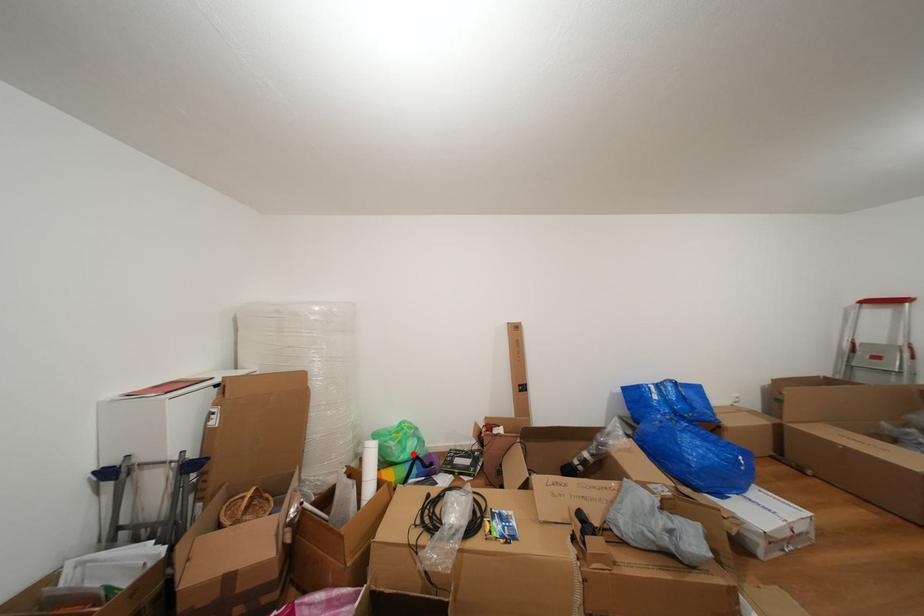
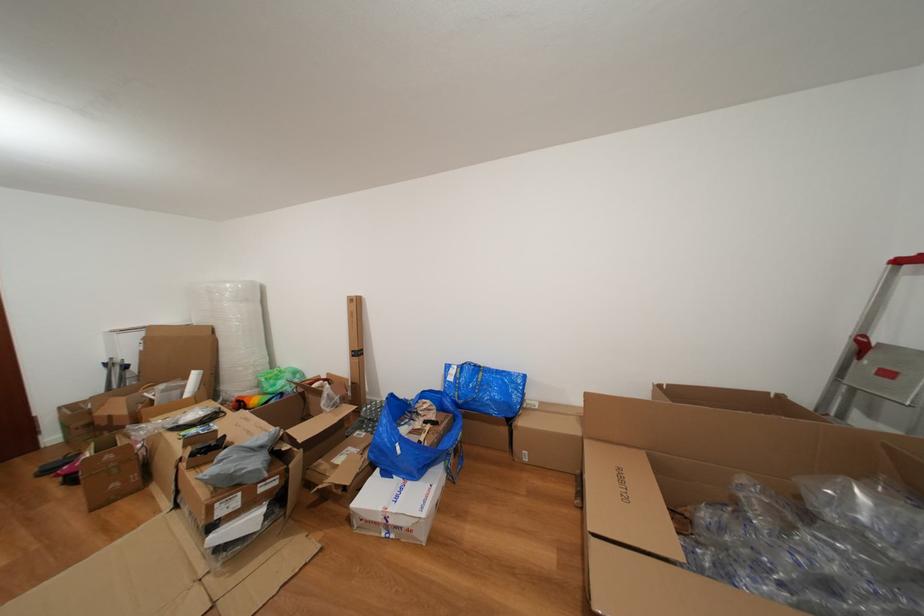
Question: I am providing you with two images of the same scene from different viewpoints. A red point is marked on the first image. At the location where the point appears in image 1, is it still visible in image 2?

Choices:
 (A) Yes
 (B) No

Answer: (A)